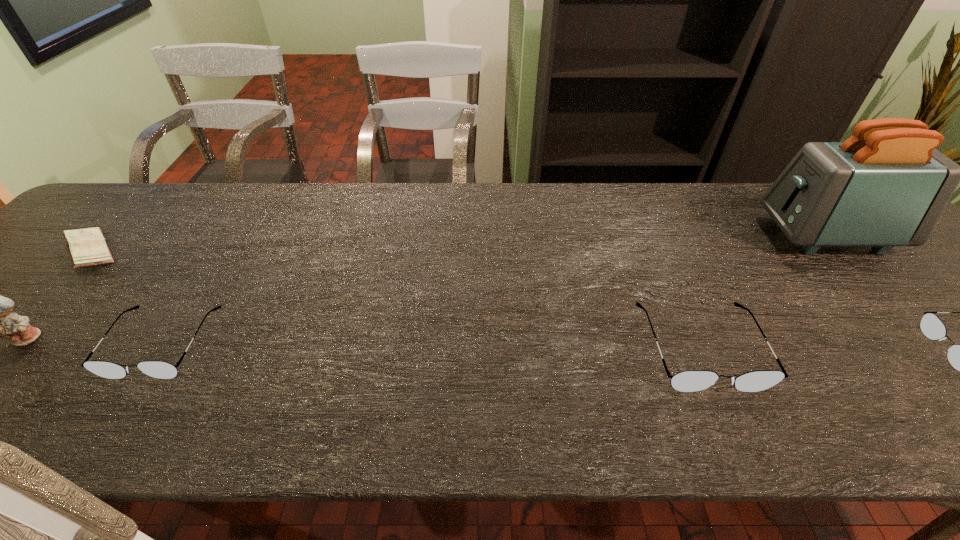
Image resolution: width=960 pixels, height=540 pixels. I want to click on the second closest spectacles relative to the toaster, so click(690, 380).

This screenshot has width=960, height=540. I want to click on free space that satisfies the following two spatial constraints: 1. on the front-facing side of the tallest object; 2. on the lenses of the second spectacles from right to left, so click(925, 348).

Find the location of a particular element. This screenshot has width=960, height=540. vacant area in the image that satisfies the following two spatial constraints: 1. on the front-facing side of the tallest object; 2. on the lenses of the tallest spectacles is located at coordinates (925, 348).